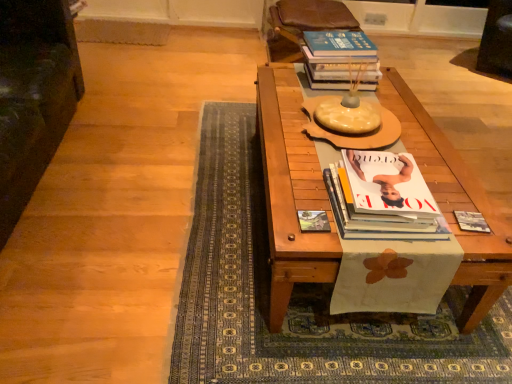
In order to click on vacant space situated on the left part of matte black book at right, which is the 1th book in bottom-to-top order in this screenshot , I will do `click(433, 237)`.